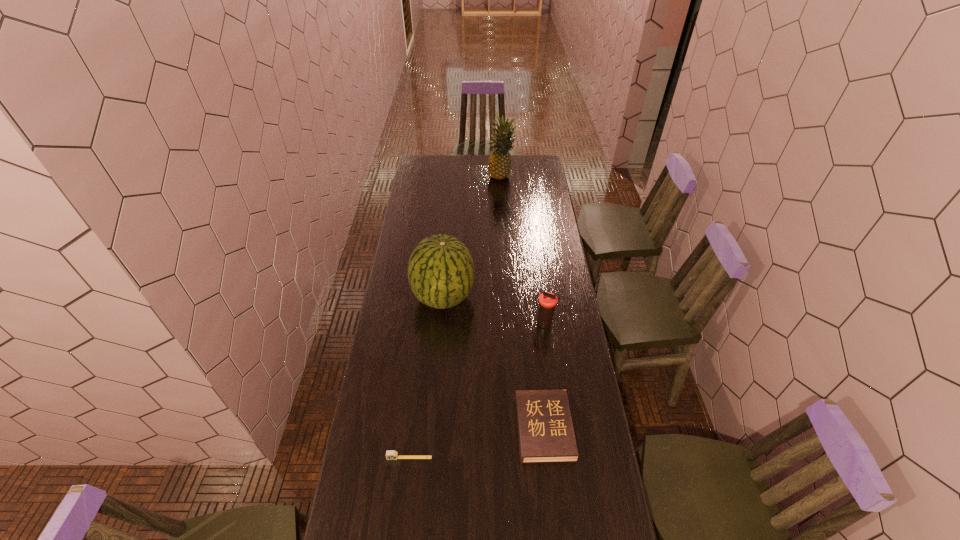
Locate which object is the closest to the thermos bottle. Please provide its 2D coordinates. Your answer should be formatted as a tuple, i.e. [(x, y)], where the tuple contains the x and y coordinates of a point satisfying the conditions above.

[(441, 274)]

Where is `free space in the image that satisfies the following two spatial constraints: 1. on the back side of the watermelon; 2. on the left side of the pineapple`? This screenshot has height=540, width=960. free space in the image that satisfies the following two spatial constraints: 1. on the back side of the watermelon; 2. on the left side of the pineapple is located at coordinates (453, 177).